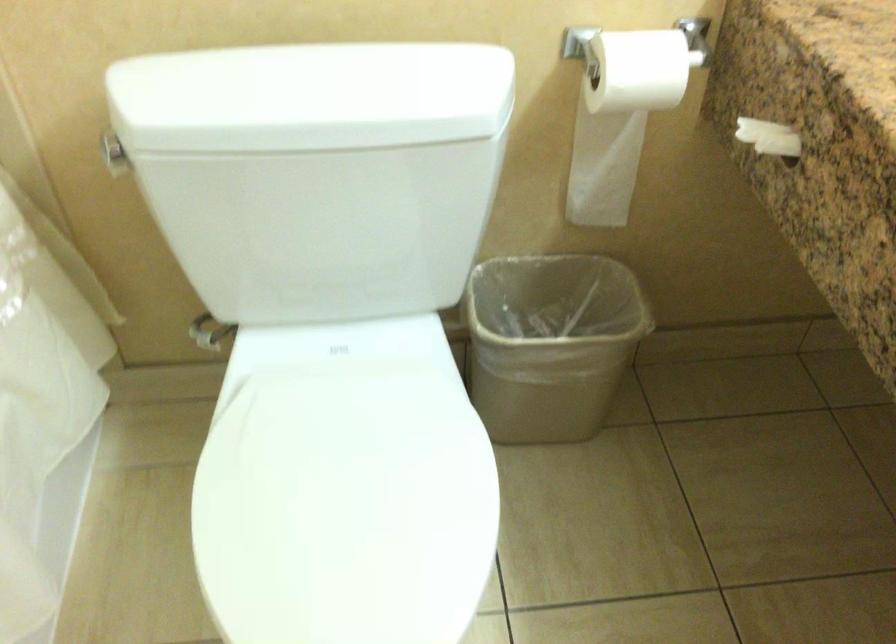
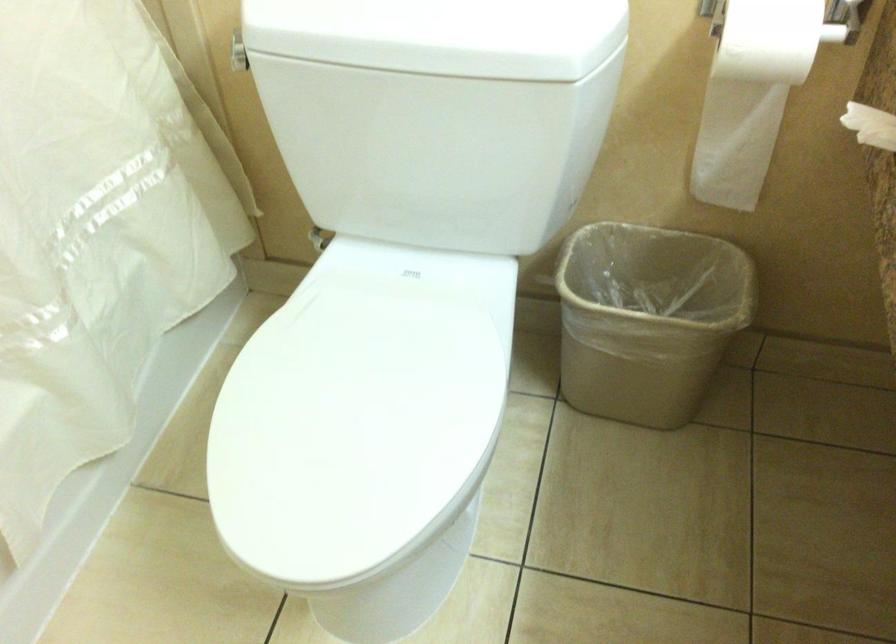
The point at (617,120) is marked in the first image. Where is the corresponding point in the second image?

(752, 93)